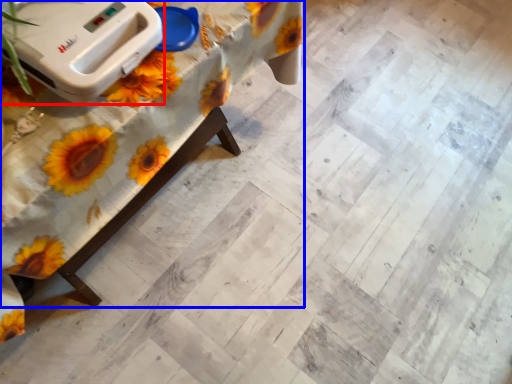
Question: Which of the following is the farthest to the observer, appliance (highlighted by a red box) or table (highlighted by a blue box)?

Choices:
 (A) appliance
 (B) table

Answer: (A)